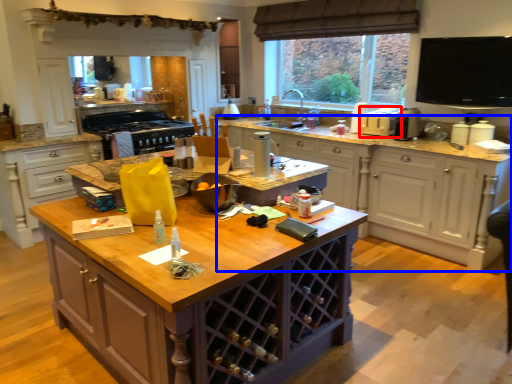
Question: Which object appears closest to the camera in this image, appliance (highlighted by a red box) or cabinetry (highlighted by a blue box)?

Choices:
 (A) appliance
 (B) cabinetry

Answer: (B)